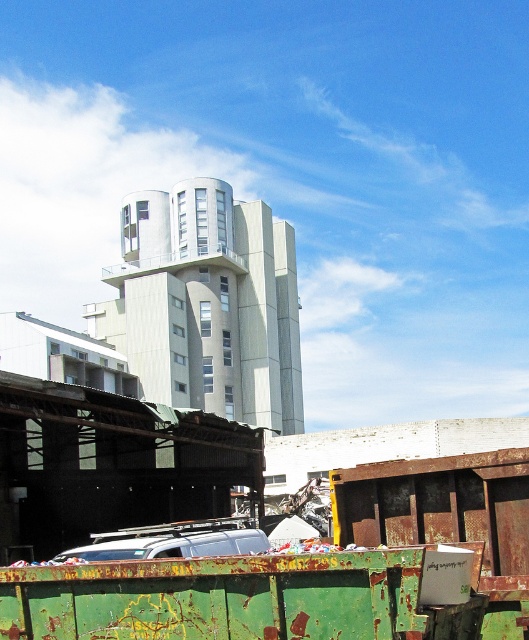
Between rusty green dumpster at lower left and silver metallic van at lower center, which one appears on the left side from the viewer's perspective?

silver metallic van at lower center

Is rusty green dumpster at lower left above silver metallic van at lower center?

Yes.

Where is `rusty green dumpster at lower left`? The image size is (529, 640). rusty green dumpster at lower left is located at coordinates (234, 598).